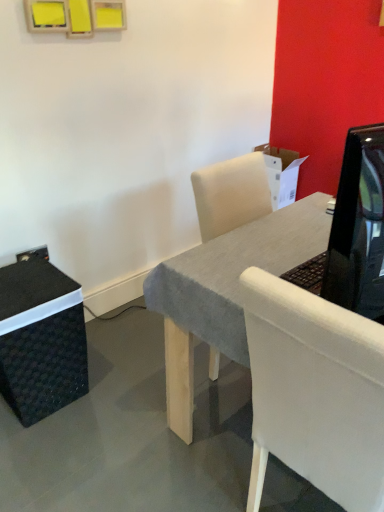
Question: Does black woven box at lower left have a greater width compared to shiny black tv at right?

Choices:
 (A) no
 (B) yes

Answer: (B)

Question: Can you confirm if black woven box at lower left is thinner than shiny black tv at right?

Choices:
 (A) yes
 (B) no

Answer: (B)

Question: From the image's perspective, is black woven box at lower left below shiny black tv at right?

Choices:
 (A) no
 (B) yes

Answer: (B)

Question: Considering the relative sizes of black woven box at lower left and shiny black tv at right in the image provided, is black woven box at lower left taller than shiny black tv at right?

Choices:
 (A) no
 (B) yes

Answer: (B)

Question: From a real-world perspective, does black woven box at lower left stand above shiny black tv at right?

Choices:
 (A) yes
 (B) no

Answer: (B)

Question: Considering the relative positions of shiny black tv at right and black woven box at lower left in the image provided, is shiny black tv at right to the left or to the right of black woven box at lower left?

Choices:
 (A) left
 (B) right

Answer: (B)

Question: From the image's perspective, is shiny black tv at right positioned above or below black woven box at lower left?

Choices:
 (A) above
 (B) below

Answer: (A)

Question: Would you say shiny black tv at right is inside or outside black woven box at lower left?

Choices:
 (A) inside
 (B) outside

Answer: (B)

Question: In terms of size, does shiny black tv at right appear bigger or smaller than black woven box at lower left?

Choices:
 (A) big
 (B) small

Answer: (B)

Question: Based on their sizes in the image, would you say white fabric chair at center is bigger or smaller than shiny black tv at right?

Choices:
 (A) small
 (B) big

Answer: (B)

Question: Looking at their shapes, would you say white fabric chair at center is wider or thinner than shiny black tv at right?

Choices:
 (A) thin
 (B) wide

Answer: (B)

Question: In the image, is white fabric chair at center positioned in front of or behind shiny black tv at right?

Choices:
 (A) behind
 (B) front

Answer: (A)

Question: In terms of height, does white fabric chair at center look taller or shorter compared to shiny black tv at right?

Choices:
 (A) short
 (B) tall

Answer: (B)

Question: In terms of height, does black woven box at lower left look taller or shorter compared to white fabric chair at center?

Choices:
 (A) tall
 (B) short

Answer: (B)

Question: Do you think black woven box at lower left is within white fabric chair at center, or outside of it?

Choices:
 (A) inside
 (B) outside

Answer: (B)